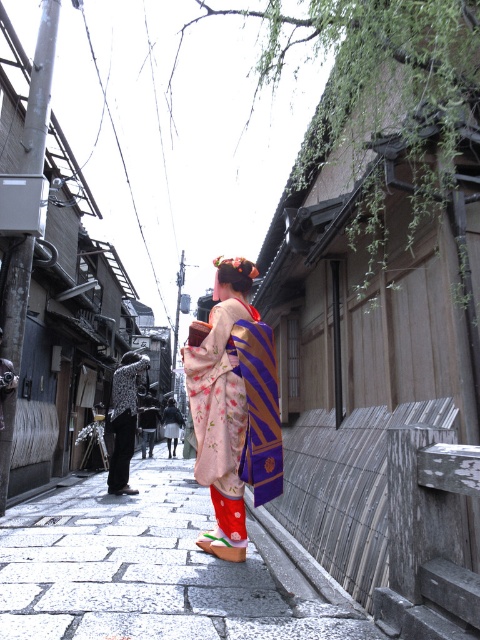
Question: Can you confirm if white stone pavement at center is positioned to the left of black textured kimono at center?

Choices:
 (A) no
 (B) yes

Answer: (B)

Question: Does white stone pavement at center have a lesser width compared to floral silk kimono at center?

Choices:
 (A) no
 (B) yes

Answer: (A)

Question: Estimate the real-world distances between objects in this image. Which object is closer to the black textured kimono at center?

Choices:
 (A) floral silk kimono at center
 (B) white stone pavement at center

Answer: (B)

Question: Which object is the farthest from the white stone pavement at center?

Choices:
 (A) black textured kimono at center
 (B) floral silk kimono at center

Answer: (B)

Question: Estimate the real-world distances between objects in this image. Which object is farther from the white stone pavement at center?

Choices:
 (A) floral silk kimono at center
 (B) black textured kimono at center

Answer: (A)

Question: Is floral silk kimono at center closer to the viewer compared to black textured kimono at center?

Choices:
 (A) no
 (B) yes

Answer: (B)